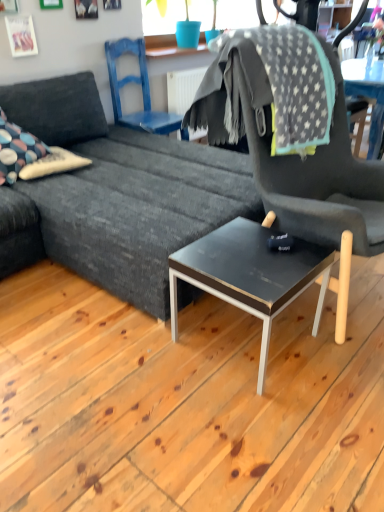
Question: Is blue painted wood chair at upper center, which is counted as the first chair, starting from the back, positioned far away from multicolored fabric pillow at left?

Choices:
 (A) yes
 (B) no

Answer: (A)

Question: Can you confirm if blue painted wood chair at upper center, the 2th chair viewed from the right, is thinner than multicolored fabric pillow at left?

Choices:
 (A) no
 (B) yes

Answer: (A)

Question: Considering the relative sizes of blue painted wood chair at upper center, which ranks as the second chair in front-to-back order, and multicolored fabric pillow at left in the image provided, is blue painted wood chair at upper center, which ranks as the second chair in front-to-back order, smaller than multicolored fabric pillow at left?

Choices:
 (A) yes
 (B) no

Answer: (B)

Question: Is blue painted wood chair at upper center, the 2th chair viewed from the right, turned away from multicolored fabric pillow at left?

Choices:
 (A) no
 (B) yes

Answer: (A)

Question: Is blue painted wood chair at upper center, the 2th chair viewed from the right, bigger than multicolored fabric pillow at left?

Choices:
 (A) no
 (B) yes

Answer: (B)

Question: Based on their sizes in the image, would you say multicolored fabric pillow at left is bigger or smaller than dark gray fabric chair at center, which appears as the 2th chair when viewed from the back?

Choices:
 (A) big
 (B) small

Answer: (B)

Question: Considering the relative positions of multicolored fabric pillow at left and dark gray fabric chair at center, the 1th chair positioned from the front, in the image provided, is multicolored fabric pillow at left to the left or to the right of dark gray fabric chair at center, the 1th chair positioned from the front,?

Choices:
 (A) right
 (B) left

Answer: (B)

Question: From the image's perspective, is multicolored fabric pillow at left positioned above or below dark gray fabric chair at center, which appears as the 2th chair when viewed from the back?

Choices:
 (A) above
 (B) below

Answer: (A)

Question: Considering the positions of multicolored fabric pillow at left and dark gray fabric chair at center, which appears as the 2th chair when viewed from the back, in the image, is multicolored fabric pillow at left taller or shorter than dark gray fabric chair at center, which appears as the 2th chair when viewed from the back,?

Choices:
 (A) short
 (B) tall

Answer: (A)

Question: Is gray star-patterned blanket at upper right wider or thinner than blue painted wood chair at upper center, which is counted as the first chair, starting from the back?

Choices:
 (A) wide
 (B) thin

Answer: (A)

Question: Does point (256, 99) appear closer or farther from the camera than point (140, 122)?

Choices:
 (A) farther
 (B) closer

Answer: (B)

Question: In the image, is gray star-patterned blanket at upper right positioned in front of or behind blue painted wood chair at upper center, which ranks as the second chair in front-to-back order?

Choices:
 (A) behind
 (B) front

Answer: (B)

Question: Visually, is gray star-patterned blanket at upper right positioned to the left or to the right of blue painted wood chair at upper center, which ranks as the second chair in front-to-back order?

Choices:
 (A) left
 (B) right

Answer: (B)

Question: In terms of width, does gray star-patterned blanket at upper right look wider or thinner when compared to black glossy coffee table at center?

Choices:
 (A) thin
 (B) wide

Answer: (B)

Question: Considering the positions of gray star-patterned blanket at upper right and black glossy coffee table at center in the image, is gray star-patterned blanket at upper right taller or shorter than black glossy coffee table at center?

Choices:
 (A) short
 (B) tall

Answer: (B)